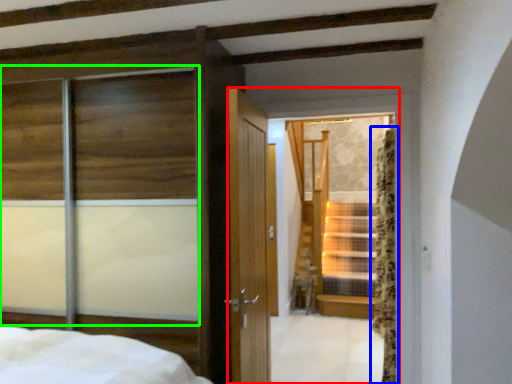
Question: Which object is the farthest from glass door (highlighted by a red box)? Choose among these: curtain (highlighted by a blue box) or window (highlighted by a green box).

Choices:
 (A) curtain
 (B) window

Answer: (A)